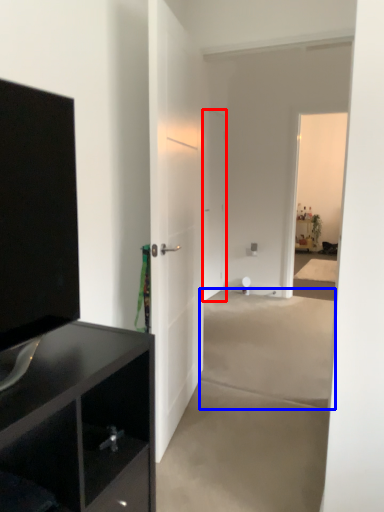
Question: Among these objects, which one is nearest to the camera, door (highlighted by a red box) or concrete (highlighted by a blue box)?

Choices:
 (A) door
 (B) concrete

Answer: (B)